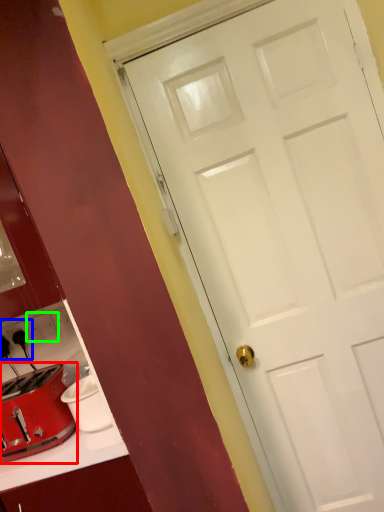
Question: Estimate the real-world distances between objects in this image. Which object is closer to toaster (highlighted by a red box), electric outlet (highlighted by a blue box) or electric outlet (highlighted by a green box)?

Choices:
 (A) electric outlet
 (B) electric outlet

Answer: (B)